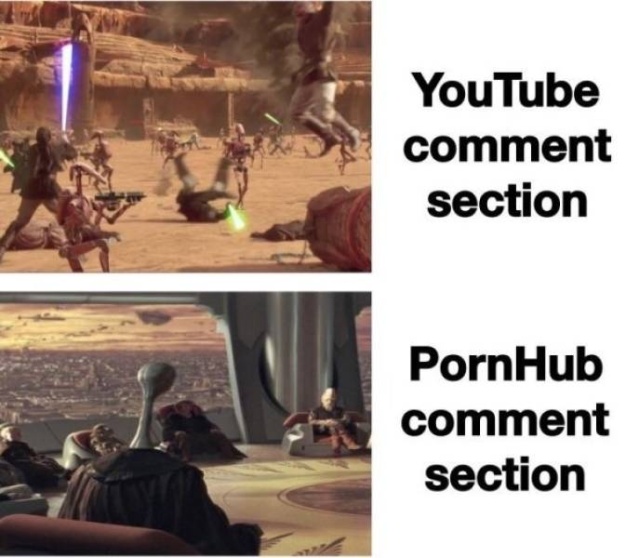
I want to click on silver wall, so click(x=294, y=369).